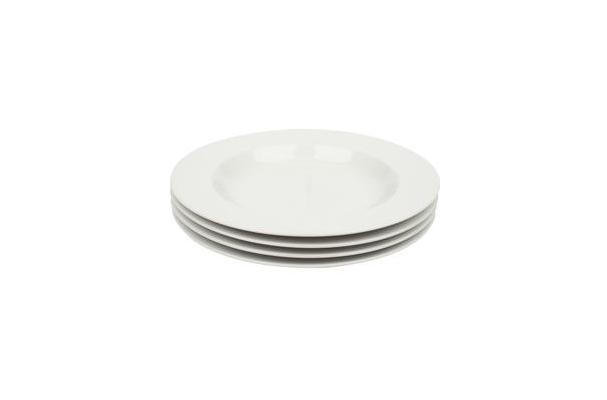
Where is `plates`? The image size is (607, 400). plates is located at coordinates (277, 229), (283, 244), (293, 254), (300, 267).